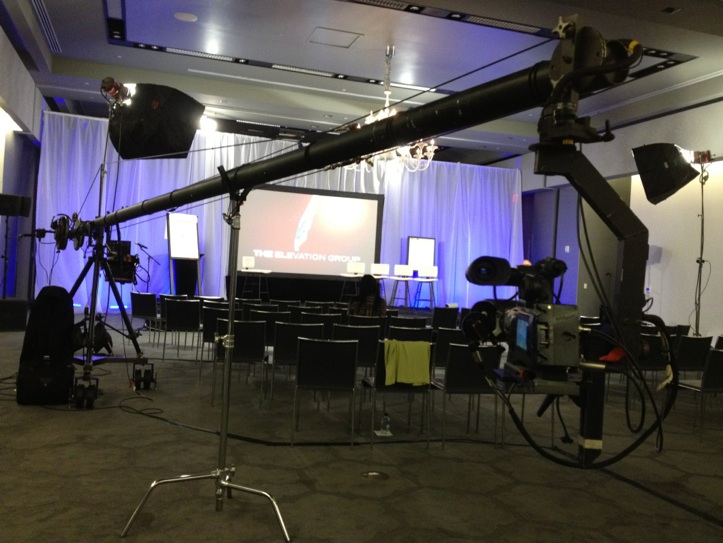
The image size is (723, 543). I want to click on floor, so click(x=440, y=475).